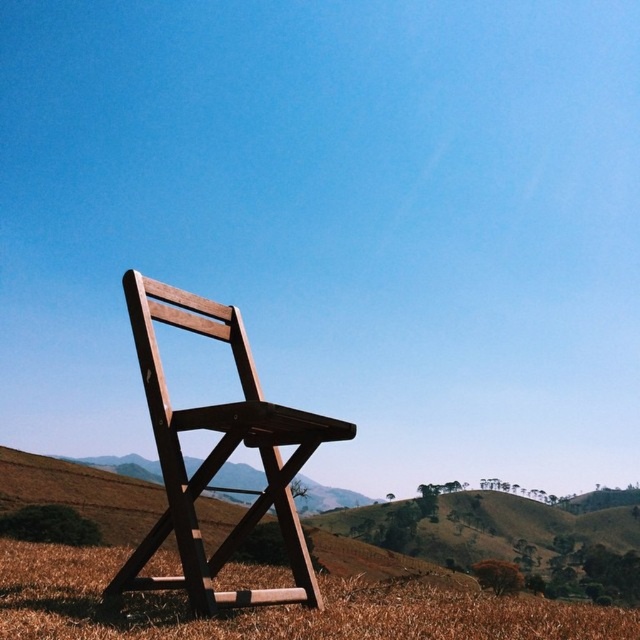
You are a photographer setting up equipment in the scene. You need to place a tripod on the brown grass at lower center so that it doesn not block the view of the wooden folding chair at center. Can the tripod be placed there without being hidden by the chair?

The brown grass at lower center is not as tall as wooden folding chair at center, so placing the tripod on the brown grass at lower center would not hide it from view since the chair is taller than the grass.

You are standing in the open landscape and want to sit down. Which object should you choose between the brown grass at lower center and the wooden folding chair at center if you prefer a firm surface?

The wooden folding chair at center provides a firm surface, while the brown grass at lower center is soft and not suitable for sitting. Choose the wooden folding chair at center.

In the scene shown: You are standing in the middle of the brown grass at lower center and want to walk to the wooden folding chair at center. Which direction should you walk to reach the chair?

The brown grass at lower center is wider than the wooden folding chair at center, so you should walk towards the center of the grass area to reach the wooden folding chair at center.